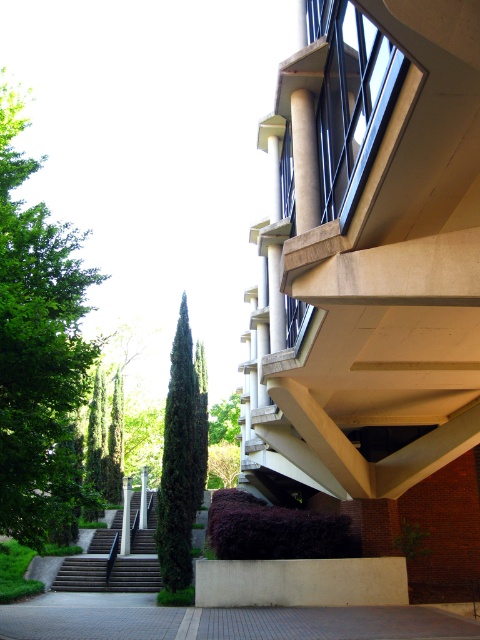
Who is taller, wooden stairs at center or green concrete pillar at center?

Standing taller between the two is green concrete pillar at center.

This screenshot has width=480, height=640. What do you see at coordinates (113, 563) in the screenshot? I see `wooden stairs at center` at bounding box center [113, 563].

Which is behind, point (106, 531) or point (129, 509)?

Positioned behind is point (106, 531).

Locate an element on the screen. This screenshot has width=480, height=640. wooden stairs at center is located at coordinates (113, 563).

Is gray brick pavement at lower center thinner than green textured tree at center?

No.

Where is `gray brick pavement at lower center`? This screenshot has height=640, width=480. gray brick pavement at lower center is located at coordinates (233, 621).

Identify the location of gray brick pavement at lower center. The height and width of the screenshot is (640, 480). (233, 621).

Does green textured tree at center have a greater width compared to wooden stairs at center?

Yes, green textured tree at center is wider than wooden stairs at center.

Is green textured tree at center above wooden stairs at center?

Yes.

Which is behind, point (190, 440) or point (137, 500)?

The point (137, 500) is more distant.

This screenshot has height=640, width=480. What are the coordinates of `green textured tree at center` in the screenshot? It's located at (181, 460).